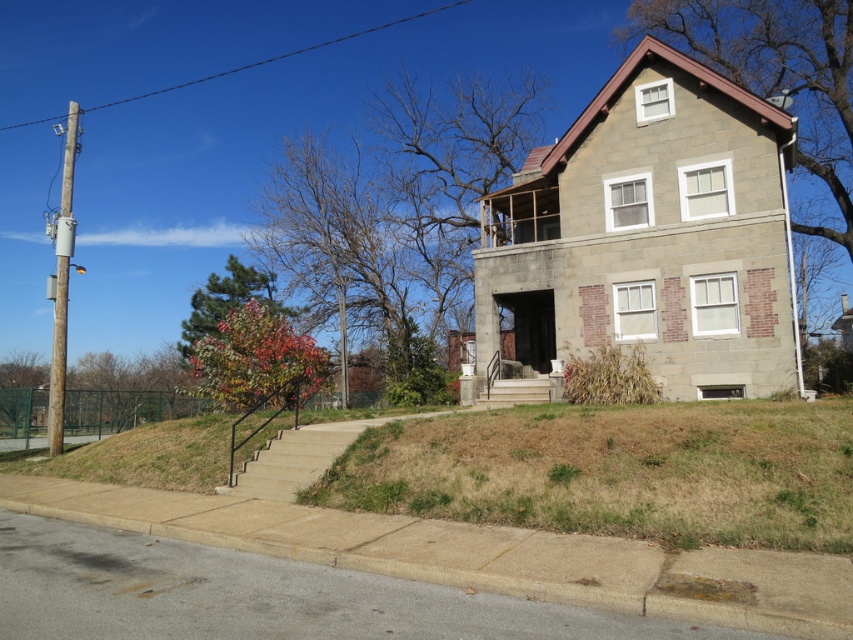
Question: Which point is closer to the camera taking this photo?

Choices:
 (A) (242, 483)
 (B) (521, 385)
 (C) (444, 577)

Answer: (C)

Question: Is concrete stairs at lower left positioned in front of stone steps at center?

Choices:
 (A) no
 (B) yes

Answer: (B)

Question: Does concrete stairs at lower left come in front of stone steps at center?

Choices:
 (A) yes
 (B) no

Answer: (A)

Question: Which object is farther from the camera taking this photo?

Choices:
 (A) stone steps at center
 (B) gray concrete curb at lower center

Answer: (A)

Question: Is gray concrete curb at lower center smaller than stone steps at center?

Choices:
 (A) no
 (B) yes

Answer: (A)

Question: Which object is positioned farthest from the concrete stairs at lower left?

Choices:
 (A) stone steps at center
 (B) gray concrete curb at lower center

Answer: (A)